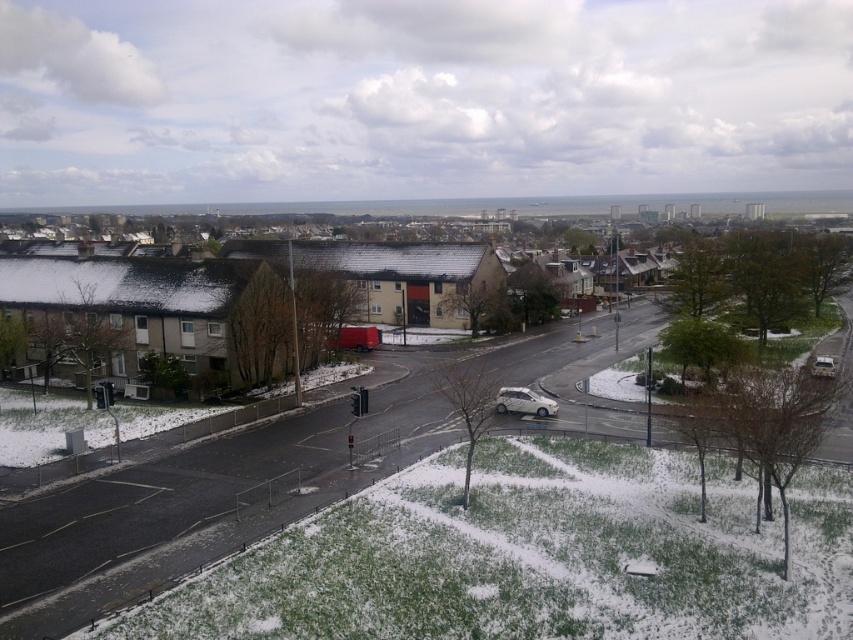
Question: Which point is farther to the camera?

Choices:
 (A) (524, 410)
 (B) (279, 522)

Answer: (A)

Question: Can you confirm if matte red truck at center is thinner than white matte car at center?

Choices:
 (A) yes
 (B) no

Answer: (B)

Question: Which point is closer to the camera?

Choices:
 (A) (503, 404)
 (B) (604, 346)

Answer: (A)

Question: Does matte red truck at center have a greater width compared to white matte car at center?

Choices:
 (A) no
 (B) yes

Answer: (B)

Question: Does matte red truck at center have a greater width compared to white matte car at center?

Choices:
 (A) no
 (B) yes

Answer: (B)